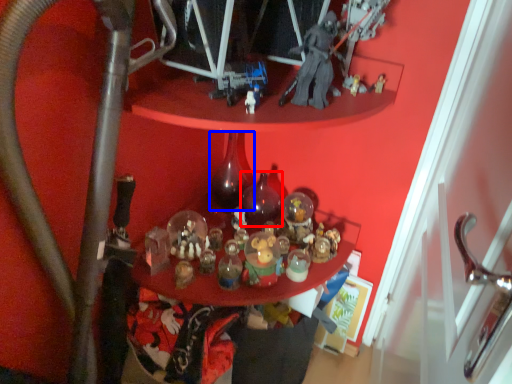
Question: Which object is further to the camera taking this photo, bottle (highlighted by a red box) or bottle (highlighted by a blue box)?

Choices:
 (A) bottle
 (B) bottle

Answer: (A)